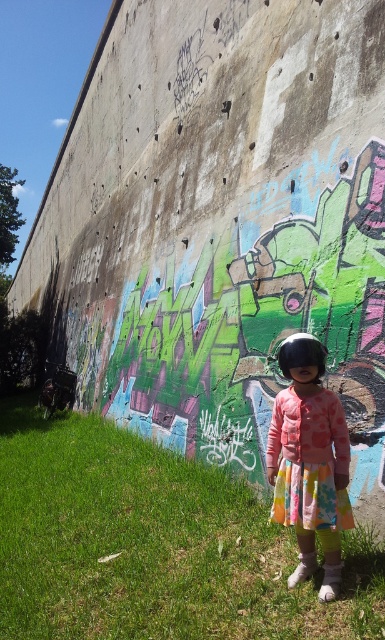
Question: Which point is farther from the camera taking this photo?

Choices:
 (A) (323, 509)
 (B) (18, 593)

Answer: (B)

Question: Does green grass at lower left have a larger size compared to matte pink dress at center?

Choices:
 (A) no
 (B) yes

Answer: (B)

Question: Among these points, which one is farthest from the camera?

Choices:
 (A) click(331, 573)
 (B) click(187, 636)

Answer: (A)

Question: Is green grass at lower left behind matte pink dress at center?

Choices:
 (A) yes
 (B) no

Answer: (B)

Question: Which point appears farthest from the camera in this image?

Choices:
 (A) (326, 596)
 (B) (0, 419)

Answer: (B)

Question: Is green grass at lower left to the left of matte pink dress at center from the viewer's perspective?

Choices:
 (A) no
 (B) yes

Answer: (B)